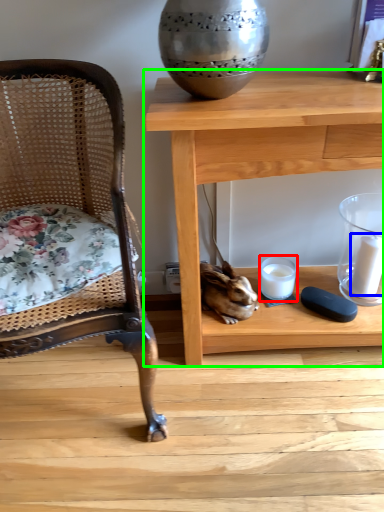
Question: Based on their relative distances, which object is farther from candle holder (highlighted by a red box)? Choose from candle (highlighted by a blue box) and table (highlighted by a green box).

Choices:
 (A) candle
 (B) table

Answer: (B)